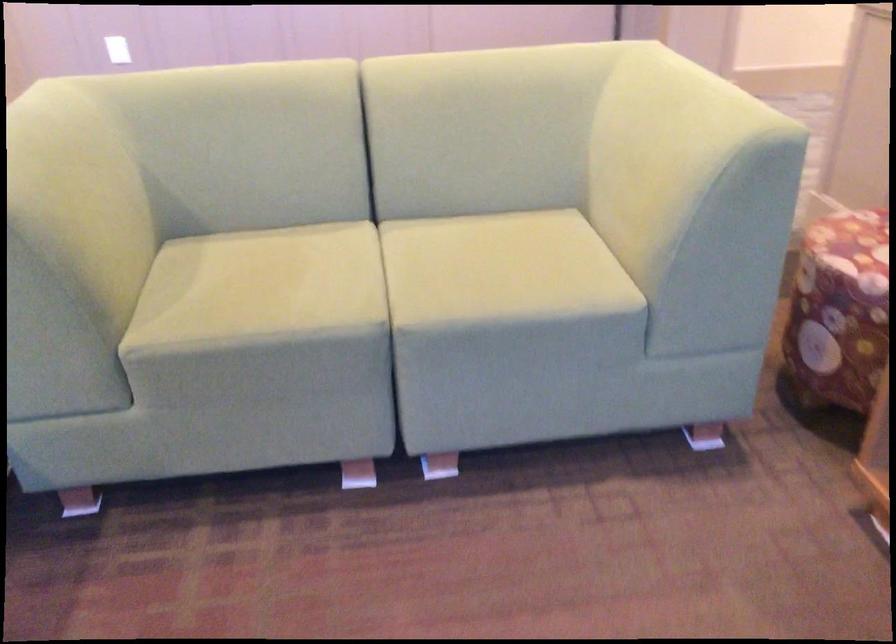
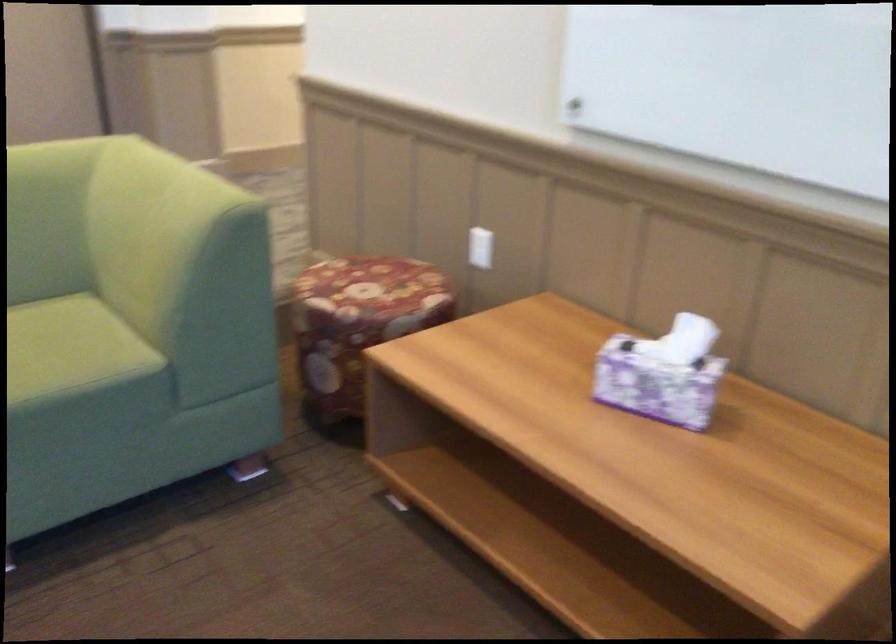
Find the pixel in the second image that matches pixel 529 248 in the first image.

(46, 339)